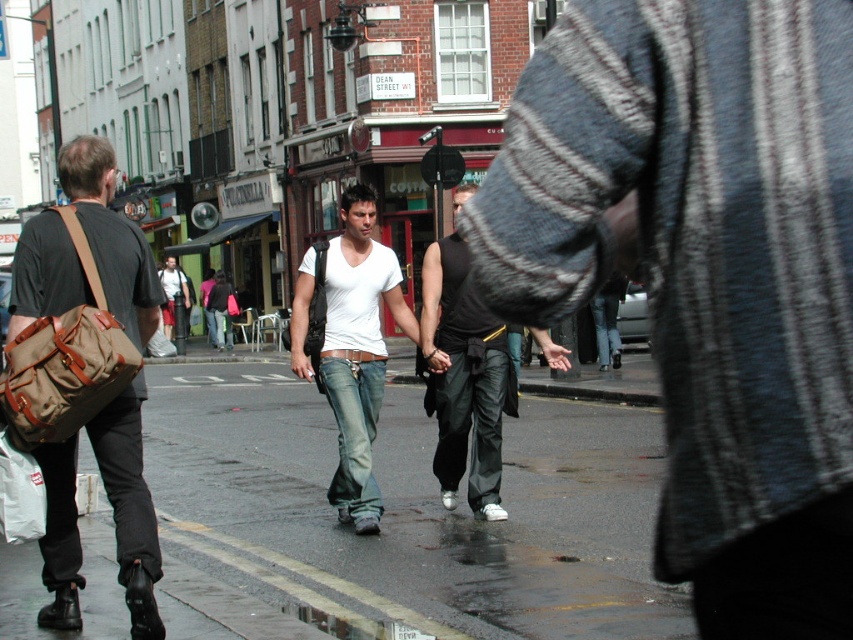
You are a delivery person who needs to hand over a matte brown bag at left to the person wearing black leather pants at center. Can you directly hand it to them without moving the bag or the pants?

The matte brown bag at left is in front of the black leather pants at center, so you can directly hand it to them without moving either object.